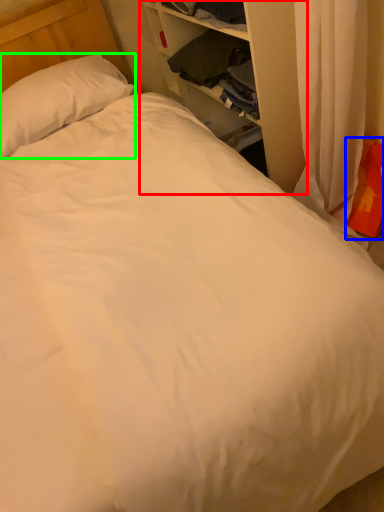
Question: Considering the real-world distances, which object is closest to dresser (highlighted by a red box)? pillow (highlighted by a blue box) or pillow (highlighted by a green box).

Choices:
 (A) pillow
 (B) pillow

Answer: (A)